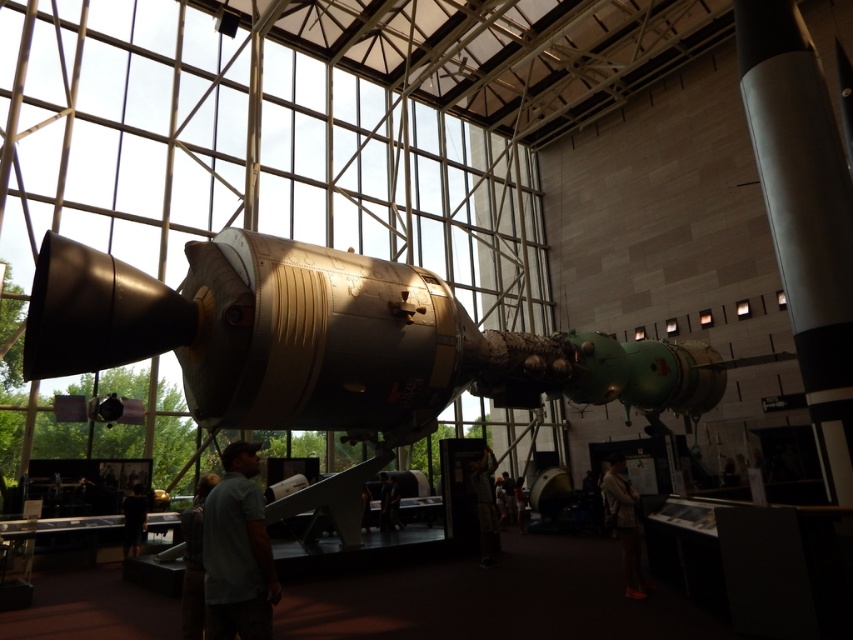
Question: Which object appears farthest from the camera in this image?

Choices:
 (A) camouflage pants at center
 (B) dark fabric pants at lower center
 (C) light brown leather jacket at lower right

Answer: (B)

Question: Observing the image, what is the correct spatial positioning of gray cotton shirt at lower left in reference to camouflage pants at center?

Choices:
 (A) above
 (B) below

Answer: (A)

Question: Which object is the closest to the shiny metallic rocket at right?

Choices:
 (A) gray cotton shirt at lower left
 (B) dark fabric pants at lower center

Answer: (A)

Question: Is light brown leather jacket at lower center in front of camouflage pants at center?

Choices:
 (A) yes
 (B) no

Answer: (A)

Question: Which point appears closest to the camera in this image?

Choices:
 (A) pyautogui.click(x=198, y=598)
 (B) pyautogui.click(x=474, y=483)
 (C) pyautogui.click(x=625, y=568)
 (D) pyautogui.click(x=210, y=563)

Answer: (D)

Question: Does shiny metallic rocket at right come behind gray cotton shirt at lower left?

Choices:
 (A) yes
 (B) no

Answer: (A)